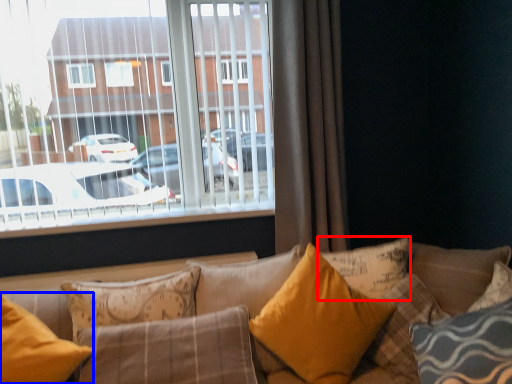
Question: Among these objects, which one is farthest to the camera, pillow (highlighted by a red box) or pillow (highlighted by a blue box)?

Choices:
 (A) pillow
 (B) pillow

Answer: (A)